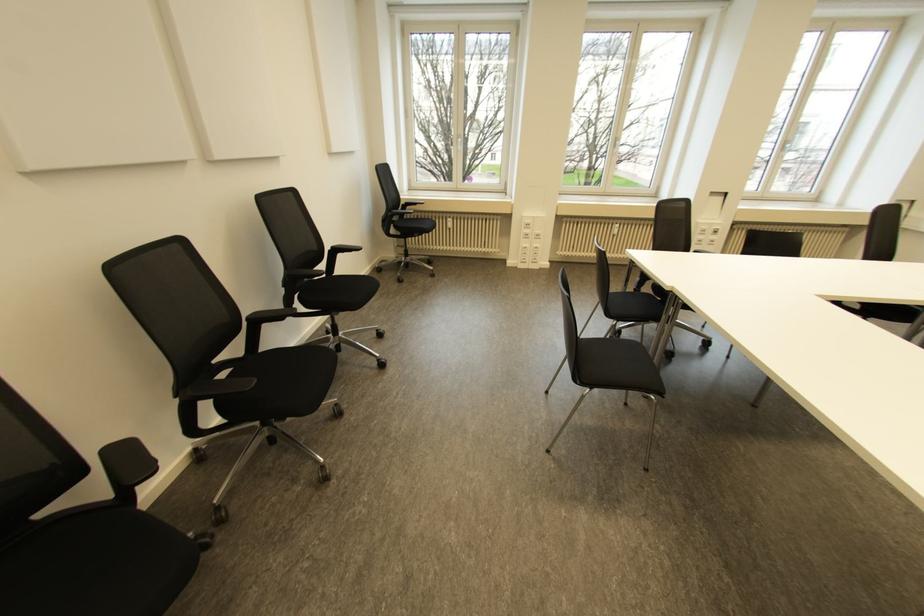
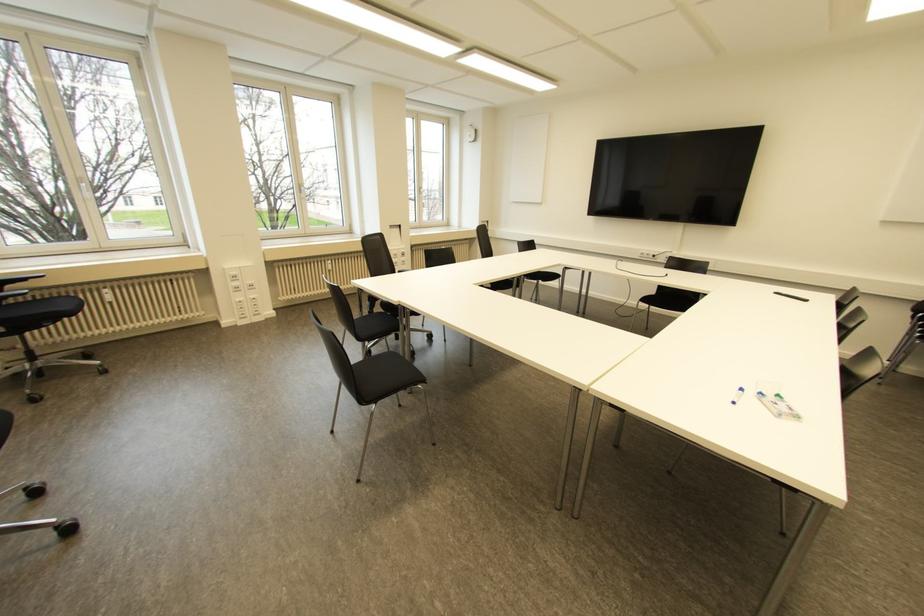
Find the pixel in the second image that matches pixel 448 219 in the first image.

(104, 290)